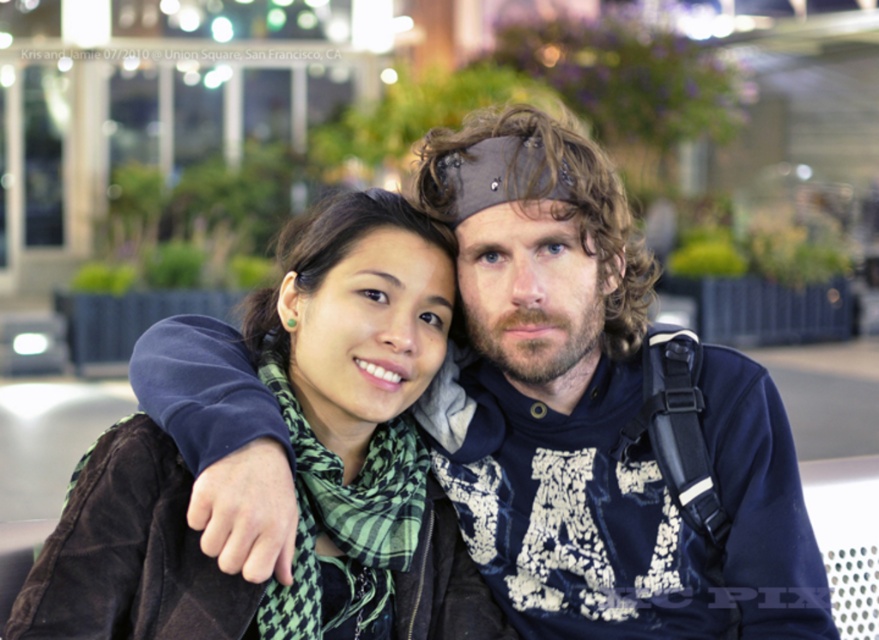
You are a photographer trying to capture a closeup of the green plaid scarf at center and the velvet blue sweatshirt at center. Based on their positions, which one is closer to the left edge of the frame?

The green plaid scarf at center is closer to the left edge of the frame because the velvet blue sweatshirt at center is positioned to its right.

What are the coordinates of the velvet blue sweatshirt at center in the image?

The coordinates of the velvet blue sweatshirt at center are at point (594, 412).

You are a photographer trying to capture a photo of the velvet blue sweatshirt at center and the green plaid scarf at center. Based on their sizes in the image, which object should you focus on first to ensure both are in frame without moving the camera?

The velvet blue sweatshirt at center is much taller than the green plaid scarf at center, so you should focus on the velvet blue sweatshirt at center first to ensure it fits within the frame since it takes up more vertical space.